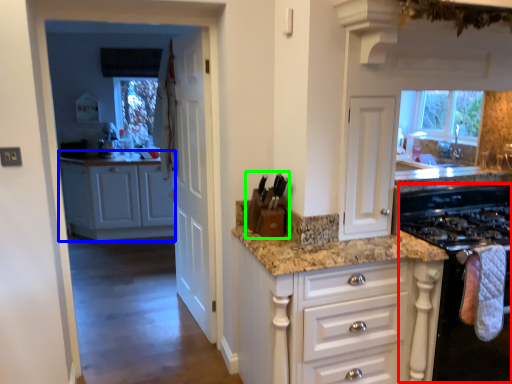
Question: Which object is the farthest from appliance (highlighted by a red box)? Choose among these: cabinetry (highlighted by a blue box) or appliance (highlighted by a green box).

Choices:
 (A) cabinetry
 (B) appliance

Answer: (A)